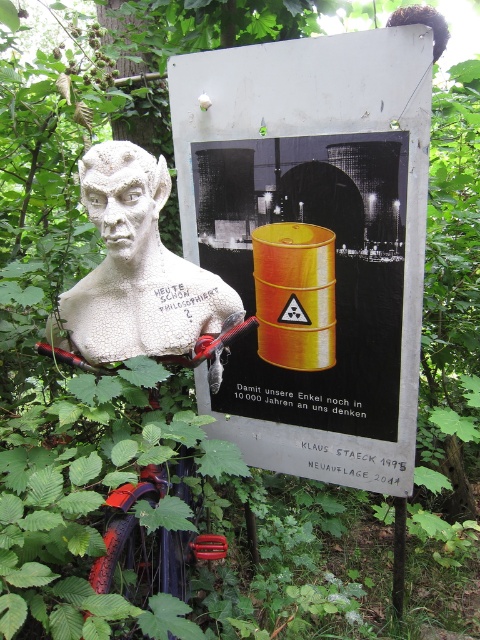
Question: Which of the following is the farthest from the observer?

Choices:
 (A) white textured bust at left
 (B) metallic yellow barrel at center

Answer: (B)

Question: Is metallic yellow barrel at center below white textured bust at left?

Choices:
 (A) yes
 (B) no

Answer: (B)

Question: Is metallic yellow barrel at center below white textured bust at left?

Choices:
 (A) yes
 (B) no

Answer: (B)

Question: Considering the relative positions of metallic yellow barrel at center and white textured bust at left in the image provided, where is metallic yellow barrel at center located with respect to white textured bust at left?

Choices:
 (A) below
 (B) above

Answer: (B)

Question: Which of the following is the closest to the observer?

Choices:
 (A) (196, 346)
 (B) (343, 268)

Answer: (A)